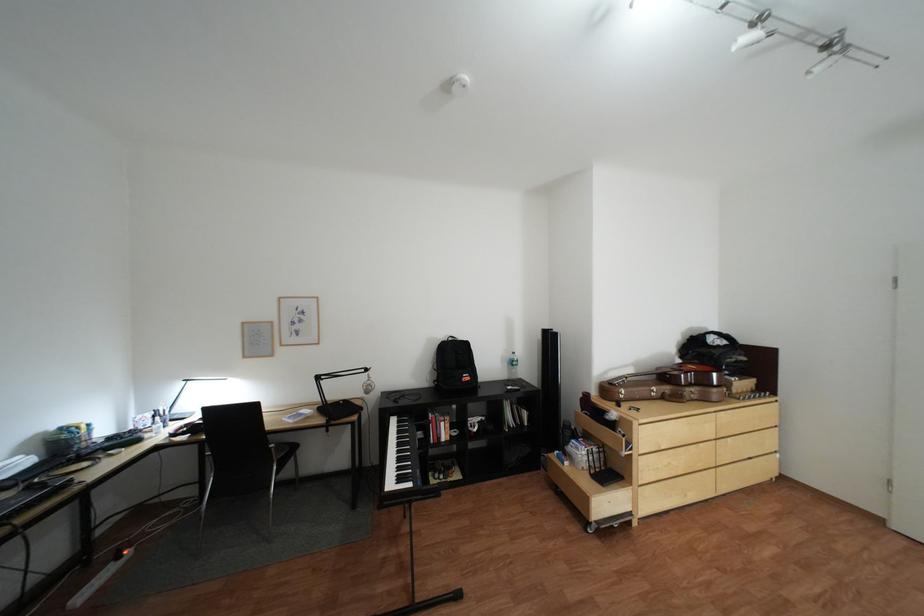
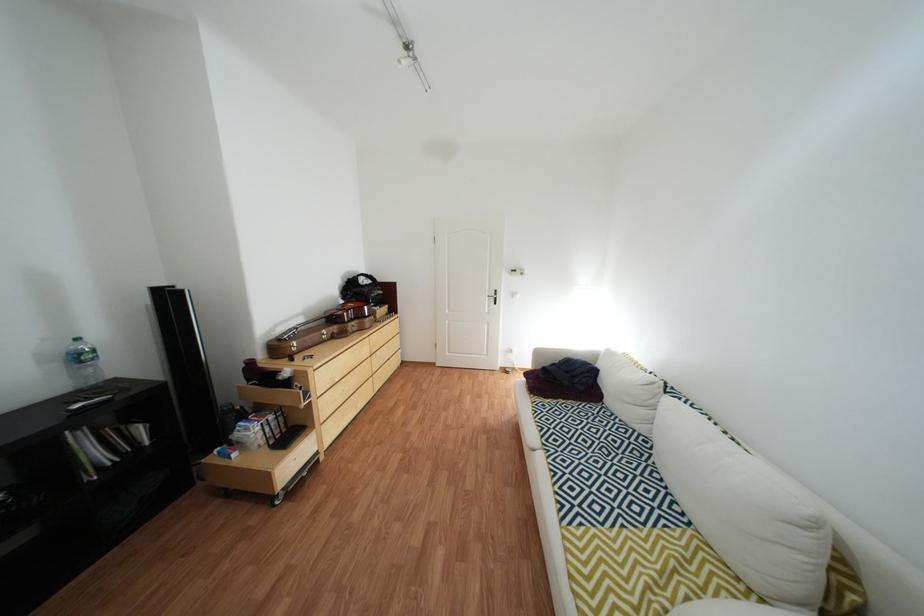
Question: Based on the continuous images, in which direction is the camera rotating? Reply with the corresponding letter.

Choices:
 (A) Left
 (B) Right
 (C) Up
 (D) Down

Answer: (B)